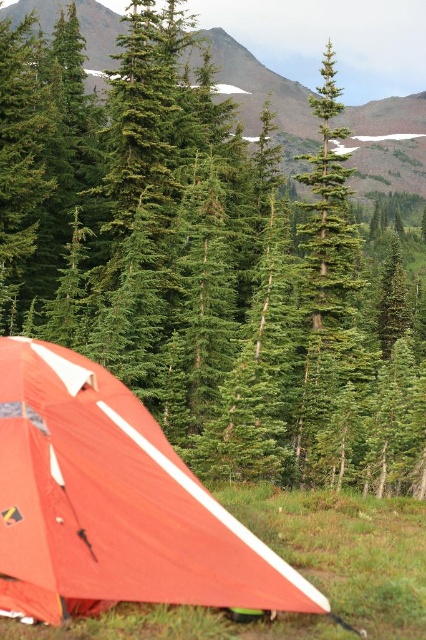
You are planning to set up a satellite dish that requires a clear line of sight to the sky. Based on the scene, which object between the green textured mountain at upper center and the green textured pine tree at center would block the view more when looking upwards?

The green textured mountain at upper center would block the view more when looking upwards since it has a greater height compared to the green textured pine tree at center.

You are a hiker who wants to take a photo of the orange fabric tent at lower left and the green textured mountain at upper center. Which object should you focus on first to ensure both are in sharp focus?

You should focus on the orange fabric tent at lower left first because it is closer to the viewer than the green textured mountain at upper center. By focusing on the closer object, the mountain in the background will still be in focus due to the depth of field.

You are standing at the center of the image and want to find the orange fabric tent at lower left. According to the coordinates provided, in which direction should you look to locate it?

The orange fabric tent at lower left is located at coordinates point (112, 502), which means you should look to the lower left direction to find it.